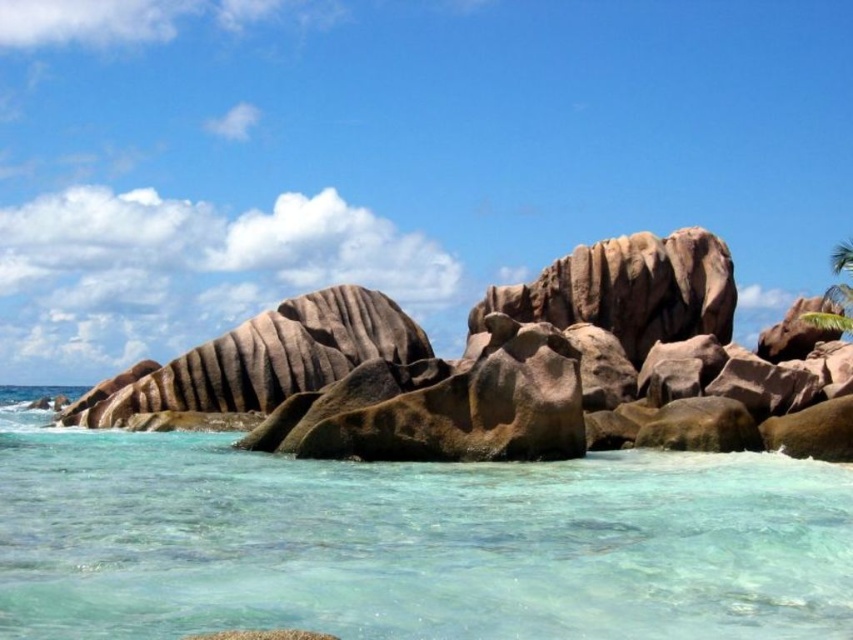
Who is more distant from viewer, (660, 561) or (846, 301)?

Positioned behind is point (846, 301).

Is point (218, 557) more distant than point (834, 259)?

No.

What are the coordinates of `clear glassy water at lower center` in the screenshot? It's located at (413, 541).

Which of these two, brown textured rock at center or green leafy palm tree at upper right, stands taller?

brown textured rock at center

Can you confirm if brown textured rock at center is shorter than green leafy palm tree at upper right?

No.

Where is `brown textured rock at center`? brown textured rock at center is located at coordinates (502, 372).

At what (x,y) coordinates should I click in order to perform the action: click on brown textured rock at center. Please return your answer as a coordinate pair (x, y). The image size is (853, 640). Looking at the image, I should click on (502, 372).

Between clear glassy water at lower center and brown textured rock at center, which one is positioned higher?

brown textured rock at center

Is clear glassy water at lower center above brown textured rock at center?

No, clear glassy water at lower center is not above brown textured rock at center.

Which is in front, point (149, 506) or point (572, 401)?

Point (149, 506) is more forward.

Locate an element on the screen. Image resolution: width=853 pixels, height=640 pixels. clear glassy water at lower center is located at coordinates point(413,541).